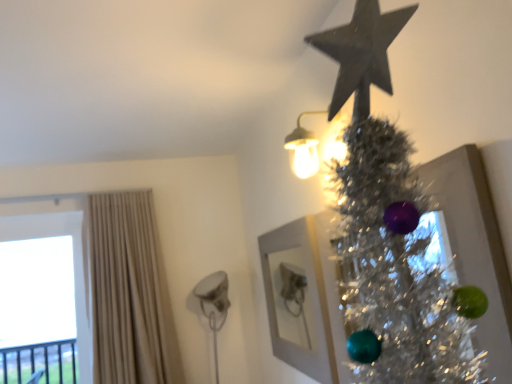
Question: Is shiny silver tinsel at upper right wider or thinner than matte white sconce at upper right?

Choices:
 (A) thin
 (B) wide

Answer: (A)

Question: Is shiny silver tinsel at upper right spatially inside matte white sconce at upper right, or outside of it?

Choices:
 (A) inside
 (B) outside

Answer: (B)

Question: Which object is positioned farthest from the white matte picture frame at upper center?

Choices:
 (A) beige fabric curtain at left
 (B) matte white sconce at upper right
 (C) transparent glass window at left
 (D) shiny silver tinsel at upper right

Answer: (C)

Question: Estimate the real-world distances between objects in this image. Which object is farther from the white matte picture frame at upper center?

Choices:
 (A) beige fabric curtain at left
 (B) shiny silver tinsel at upper right
 (C) transparent glass window at left
 (D) matte white sconce at upper right

Answer: (C)